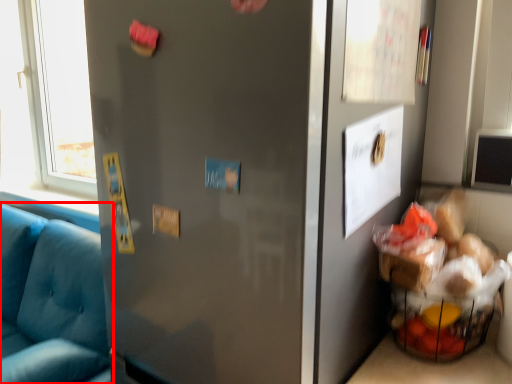
Question: From the image's perspective, what is the correct spatial positioning of studio couch (annotated by the red box) in reference to door?

Choices:
 (A) above
 (B) below

Answer: (B)